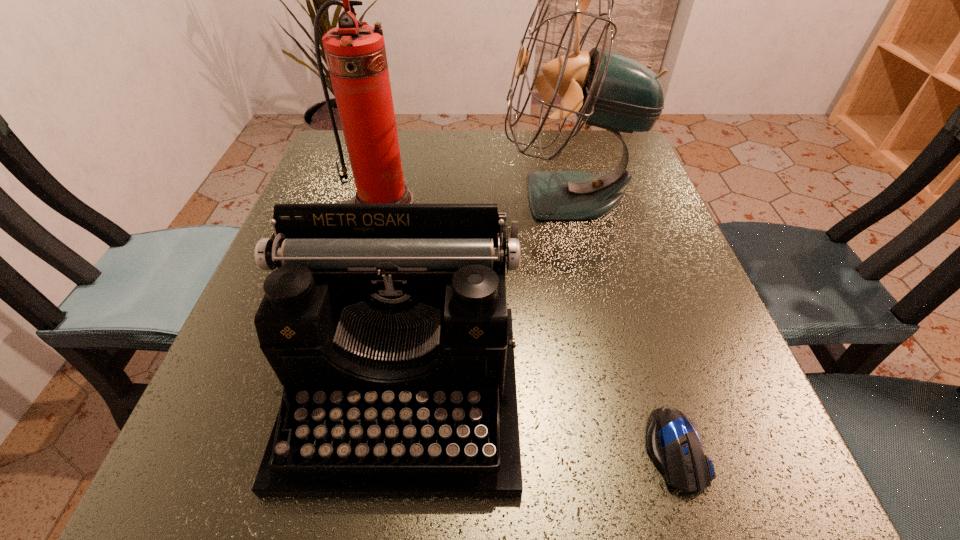
In the image, there is a desktop. Identify the location of vacant space at the right edge. (644, 374).

Identify the location of blank space at the far left corner. This screenshot has height=540, width=960. (333, 146).

Find the location of a particular element. The height and width of the screenshot is (540, 960). unoccupied area between the fire extinguisher and the shortest object is located at coordinates (529, 326).

Find the location of `vacant area that lies between the shortest object and the fan`. vacant area that lies between the shortest object and the fan is located at coordinates click(622, 323).

The width and height of the screenshot is (960, 540). What are the coordinates of `empty space that is in between the computer mouse and the typewriter` in the screenshot? It's located at (540, 421).

Where is `vacant area that lies between the fire extinguisher and the fan`? This screenshot has width=960, height=540. vacant area that lies between the fire extinguisher and the fan is located at coordinates (476, 199).

Find the location of a particular element. The image size is (960, 540). unoccupied area between the fire extinguisher and the computer mouse is located at coordinates [x=529, y=326].

You are a GUI agent. You are given a task and a screenshot of the screen. Output one action in this format:
    pyautogui.click(x=<x>, y=<y>)
    Task: Click on the free space between the shortest object and the fire extinguisher
    The height and width of the screenshot is (540, 960).
    Given the screenshot: What is the action you would take?
    pyautogui.click(x=529, y=326)

Point out which object is positioned as the third nearest to the fan. Please provide its 2D coordinates. Your answer should be formatted as a tuple, i.e. [(x, y)], where the tuple contains the x and y coordinates of a point satisfying the conditions above.

[(673, 442)]

In order to click on object identified as the second closest to the fire extinguisher in this screenshot , I will do `click(387, 325)`.